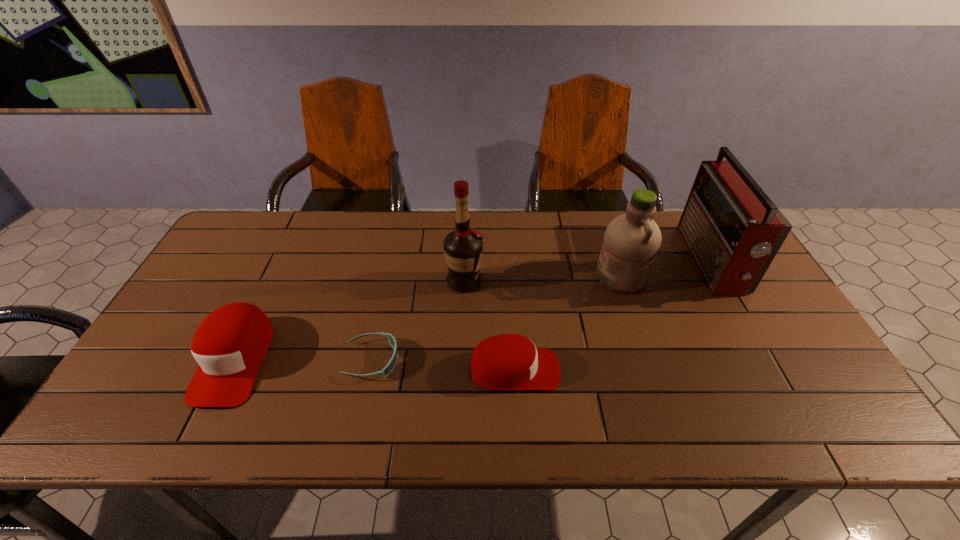
The width and height of the screenshot is (960, 540). I want to click on vacant space that's between the left baseball cap and the liquor, so click(349, 321).

I want to click on vacant point located between the cleansing agent and the third shortest object, so click(x=428, y=318).

The width and height of the screenshot is (960, 540). Find the location of `free space between the second shortest object and the taller baseball cap`. free space between the second shortest object and the taller baseball cap is located at coordinates (374, 364).

At what (x,y) coordinates should I click in order to perform the action: click on free area in between the leftmost object and the fifth object from right to left. Please return your answer as a coordinate pair (x, y). Looking at the image, I should click on click(303, 360).

Locate an element on the screen. blank region between the shorter baseball cap and the goggles is located at coordinates (444, 365).

At what (x,y) coordinates should I click in order to perform the action: click on free space between the left baseball cap and the fifth tallest object. Please return your answer as a coordinate pair (x, y). Looking at the image, I should click on (374, 364).

Identify the location of free point between the leftmost object and the second object from left to right. This screenshot has height=540, width=960. (303, 360).

At what (x,y) coordinates should I click in order to perform the action: click on free point between the liquor and the cleansing agent. Please return your answer as a coordinate pair (x, y). The width and height of the screenshot is (960, 540). Looking at the image, I should click on (543, 279).

The width and height of the screenshot is (960, 540). What are the coordinates of `empty space between the cleansing agent and the rightmost object` in the screenshot? It's located at (666, 268).

Where is `free space between the leftmost object and the right baseball cap`? free space between the leftmost object and the right baseball cap is located at coordinates (374, 364).